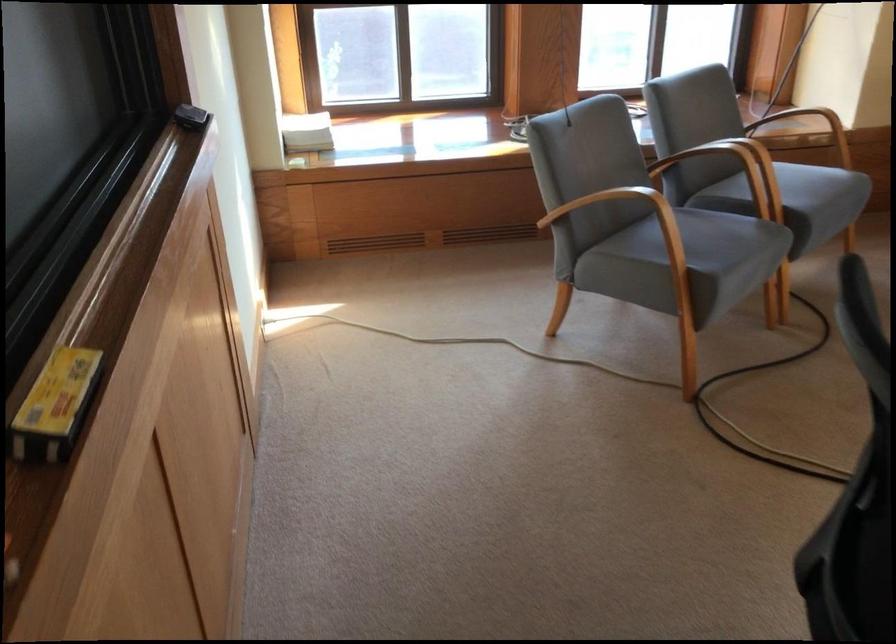
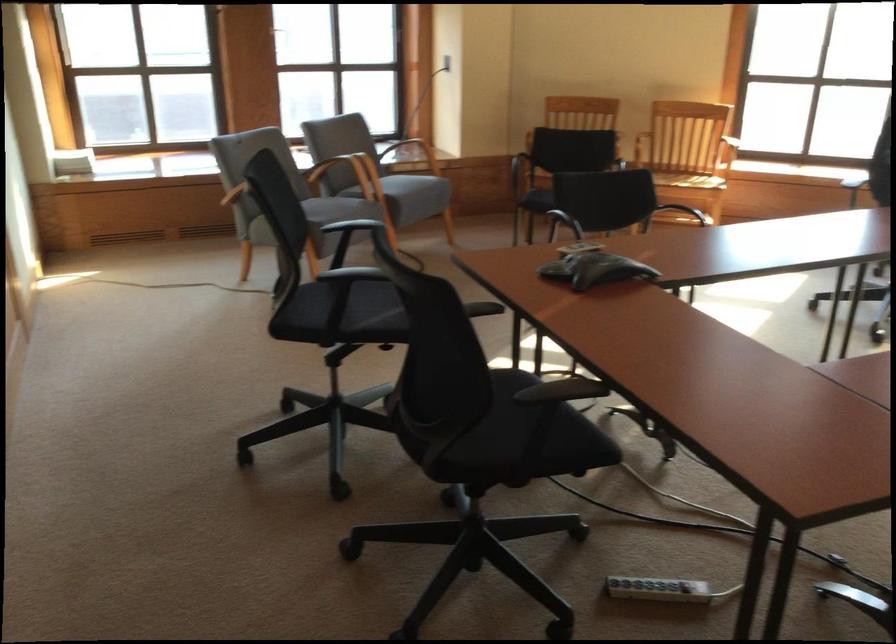
Where in the second image is the point corresponding to point (691, 167) from the first image?

(342, 172)